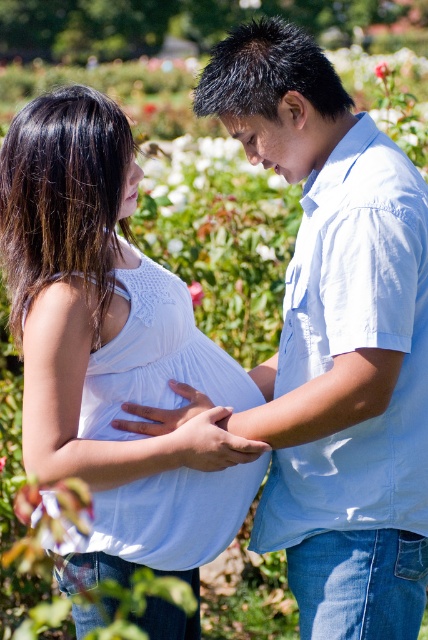
You are a tailor measuring a light blue cotton shirt at center and a matte skin hand at center for alterations. Which object is bigger in size?

The light blue cotton shirt at center is larger in size than the matte skin hand at center.

Based on the coordinates provided, which object in the scene is located at point (338,340)?

The point (338,340) corresponds to the light blue cotton shirt at center.

Based on the photo, you are a photographer setting up a shoot in this garden scene. You have a camera with a lens that can focus on objects with a width between 10 cm to 20 cm. You need to focus on both the white smooth shirt at center and the pink matte rose at upper center. Which object should you adjust the lens width for first to ensure both can be captured clearly?

The white smooth shirt at center is thinner than the pink matte rose at upper center, so you should first adjust the lens width to accommodate the pink matte rose at upper center since it is wider. Then, you can reduce the lens width to capture the white smooth shirt at center within the 10 cm to 20 cm range.